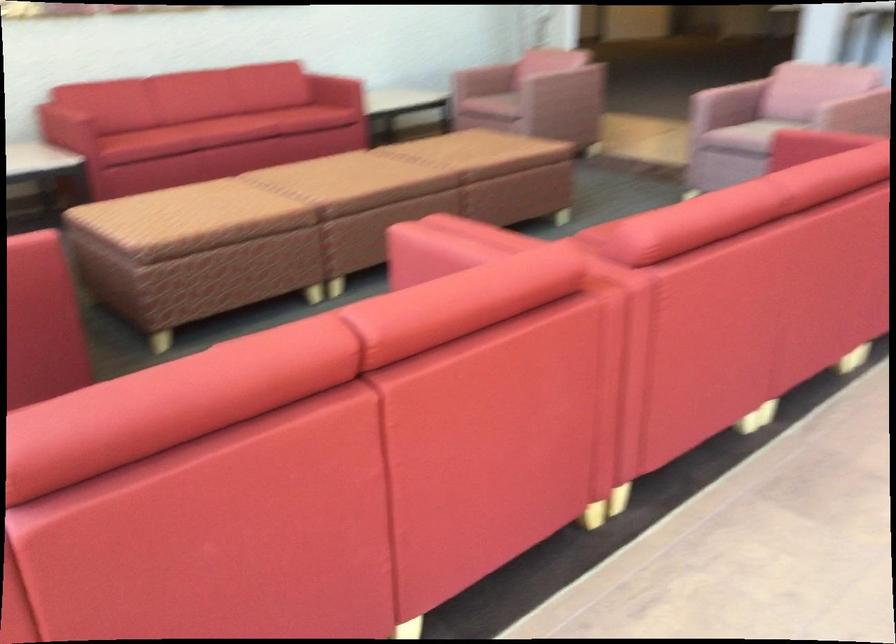
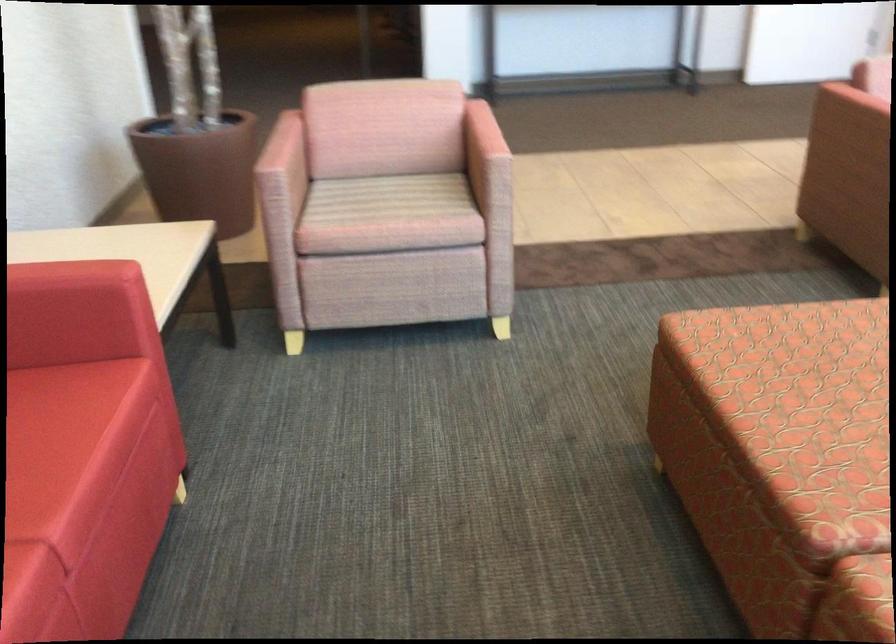
In the second image, find the point that corresponds to [540,75] in the first image.

(481, 133)